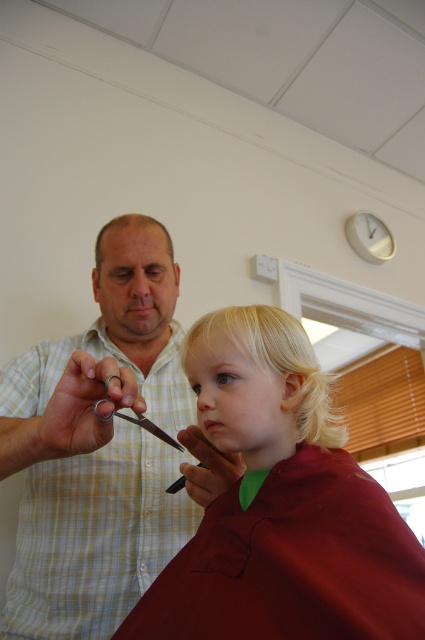
Question: Which object is farther from the camera taking this photo?

Choices:
 (A) blonde silky hair at center
 (B) checkered fabric shirt at upper left
 (C) blonde hair at center

Answer: (A)

Question: Which of the following is the closest to the observer?

Choices:
 (A) metallic shears at center
 (B) blonde silky hair at center

Answer: (A)

Question: Can you confirm if blonde hair at center is thinner than blonde silky hair at center?

Choices:
 (A) no
 (B) yes

Answer: (A)

Question: Is blonde silky hair at center bigger than metallic shears at center?

Choices:
 (A) no
 (B) yes

Answer: (B)

Question: Does blonde hair at center have a smaller size compared to blonde silky hair at center?

Choices:
 (A) yes
 (B) no

Answer: (B)

Question: Which object appears closest to the camera in this image?

Choices:
 (A) blonde silky hair at center
 (B) checkered fabric shirt at upper left
 (C) blonde hair at center
 (D) metallic shears at center

Answer: (C)